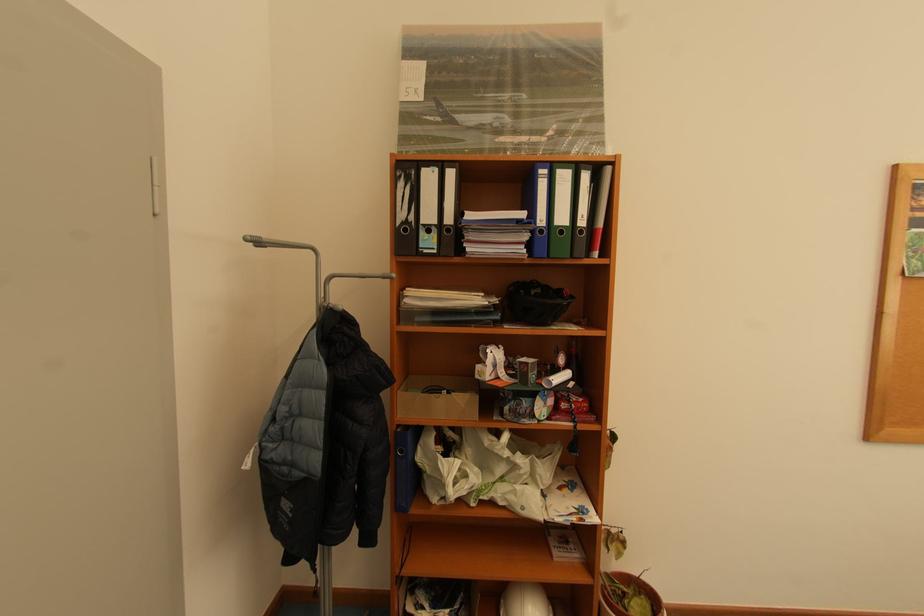
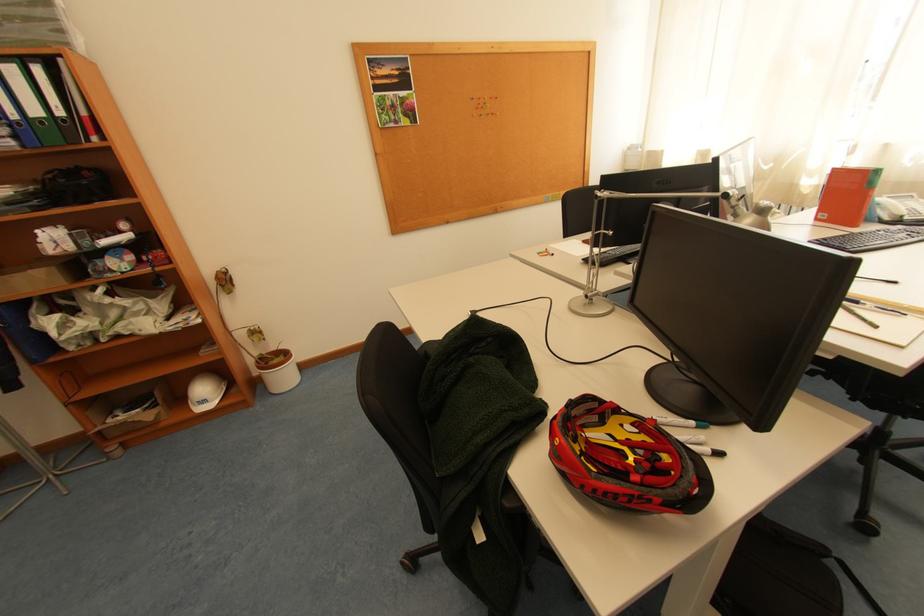
The point at (538, 246) is marked in the first image. Where is the corresponding point in the second image?

(23, 139)